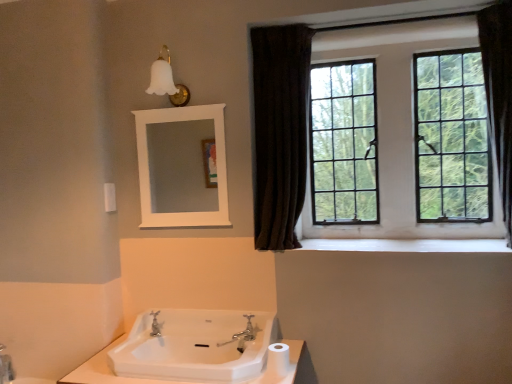
Locate an element on the screen. vacant space that is in between silver metallic tap at lower center and silver metallic faucet at center is located at coordinates (202, 339).